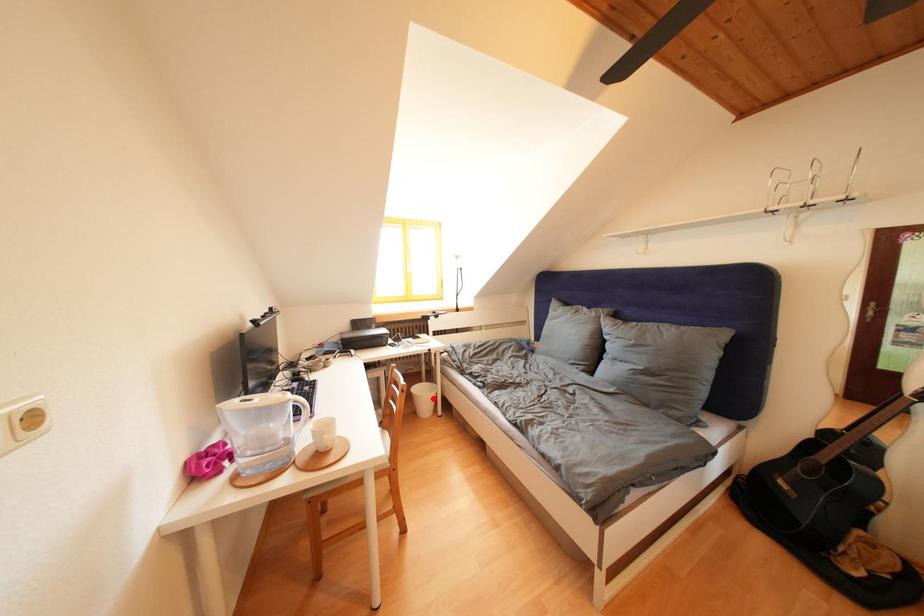
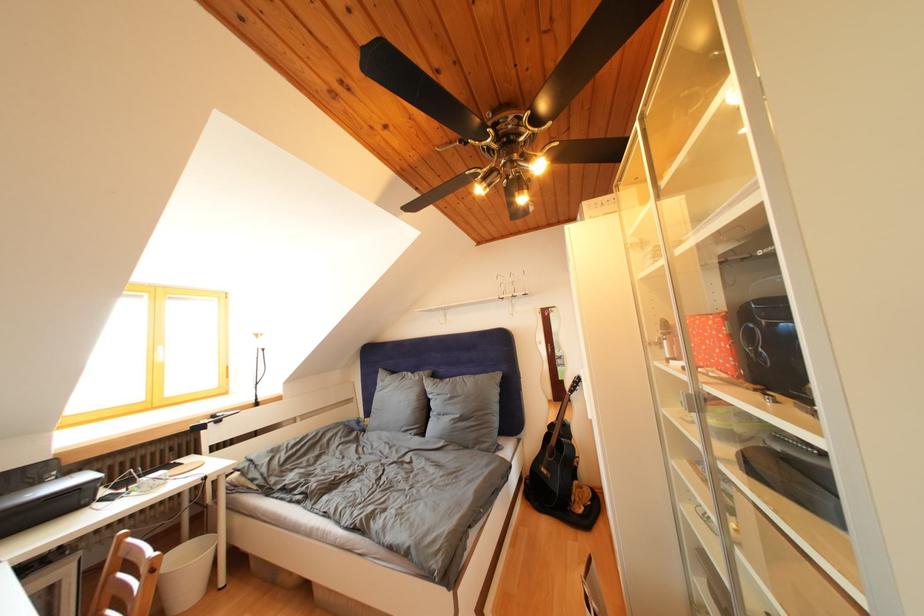
In the second image, find the point that corresponds to the highlighted location in the first image.

(198, 565)